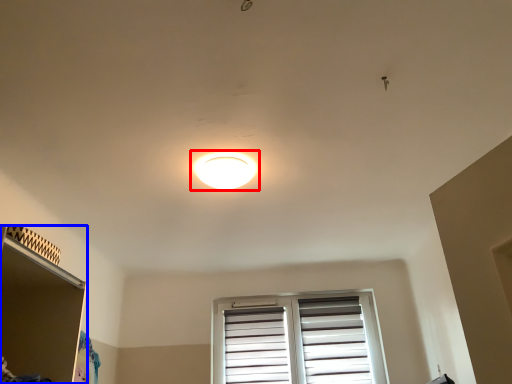
Question: Which object appears closest to the camera in this image, lamp (highlighted by a red box) or shelf (highlighted by a blue box)?

Choices:
 (A) lamp
 (B) shelf

Answer: (B)